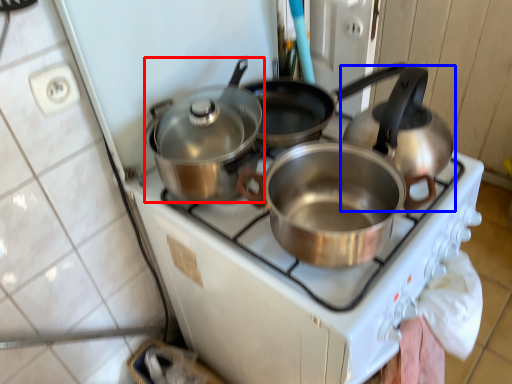
Question: Which of the following is the farthest to the observer, kitchen appliance (highlighted by a red box) or kettle (highlighted by a blue box)?

Choices:
 (A) kitchen appliance
 (B) kettle

Answer: (A)